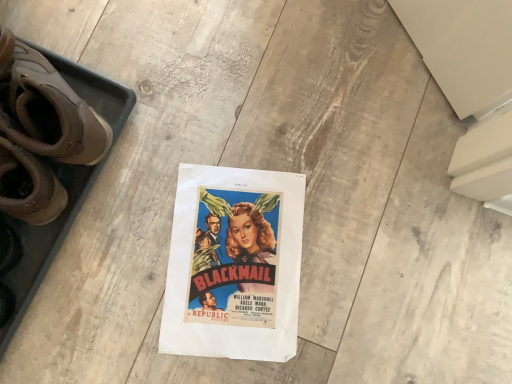
This screenshot has height=384, width=512. Describe the element at coordinates (234, 264) in the screenshot. I see `matte paper poster at center` at that location.

Where is `matte paper poster at center`? The image size is (512, 384). matte paper poster at center is located at coordinates (234, 264).

This screenshot has width=512, height=384. Describe the element at coordinates (54, 110) in the screenshot. I see `brown leather boots at left` at that location.

Find the location of a particular element. Image resolution: width=512 pixels, height=384 pixels. brown leather boots at left is located at coordinates (54, 110).

Find the location of a particular element. This screenshot has width=512, height=384. matte paper poster at center is located at coordinates (234, 264).

In the scene shown: Considering the relative positions of matte paper poster at center and brown leather boots at left in the image provided, is matte paper poster at center to the right of brown leather boots at left from the viewer's perspective?

Yes.

From the picture: Considering the positions of objects matte paper poster at center and brown leather boots at left in the image provided, who is in front, matte paper poster at center or brown leather boots at left?

Positioned in front is brown leather boots at left.

Does point (257, 257) lie behind point (0, 128)?

That is True.

From the picture: From the image's perspective, which object appears higher, matte paper poster at center or brown leather boots at left?

brown leather boots at left appears higher in the image.

From a real-world perspective, is matte paper poster at center above or below brown leather boots at left?

matte paper poster at center is situated lower than brown leather boots at left in the real world.

Considering the sizes of matte paper poster at center and brown leather boots at left in the image, is matte paper poster at center wider or thinner than brown leather boots at left?

Considering their sizes, matte paper poster at center looks broader than brown leather boots at left.

Considering the relative sizes of matte paper poster at center and brown leather boots at left in the image provided, is matte paper poster at center taller than brown leather boots at left?

No, matte paper poster at center is not taller than brown leather boots at left.

Looking at the image, does matte paper poster at center seem bigger or smaller compared to brown leather boots at left?

Clearly, matte paper poster at center is smaller in size than brown leather boots at left.

Is brown leather boots at left located within matte paper poster at center?

That's incorrect, brown leather boots at left is not inside matte paper poster at center.

In the scene shown: Is matte paper poster at center placed right next to brown leather boots at left?

No.

In the scene shown: Is matte paper poster at center facing towards brown leather boots at left?

No, matte paper poster at center is not aimed at brown leather boots at left.

Measure the distance between matte paper poster at center and brown leather boots at left.

The distance of matte paper poster at center from brown leather boots at left is 9.90 inches.

Locate an element on the screen. poster behind the brown leather boots at left is located at coordinates (234, 264).

Is brown leather boots at left to the left of matte paper poster at center from the viewer's perspective?

Yes, brown leather boots at left is to the left of matte paper poster at center.

Considering the positions of objects brown leather boots at left and matte paper poster at center in the image provided, who is behind, brown leather boots at left or matte paper poster at center?

matte paper poster at center is behind.

Does point (68, 141) come farther from viewer compared to point (226, 173)?

No, it is in front of (226, 173).

From the image's perspective, would you say brown leather boots at left is shown under matte paper poster at center?

No, from the image's perspective, brown leather boots at left is not beneath matte paper poster at center.

From a real-world perspective, which is physically above, brown leather boots at left or matte paper poster at center?

brown leather boots at left, from a real-world perspective.

Considering the sizes of objects brown leather boots at left and matte paper poster at center in the image provided, who is thinner, brown leather boots at left or matte paper poster at center?

brown leather boots at left.

Who is taller, brown leather boots at left or matte paper poster at center?

brown leather boots at left.

Is brown leather boots at left bigger than matte paper poster at center?

Yes.

Is brown leather boots at left inside or outside of matte paper poster at center?

brown leather boots at left is located beyond the bounds of matte paper poster at center.

Is brown leather boots at left next to matte paper poster at center and touching it?

There is a gap between brown leather boots at left and matte paper poster at center.

Is brown leather boots at left oriented towards matte paper poster at center?

No, brown leather boots at left is not oriented towards matte paper poster at center.

What's the angular difference between brown leather boots at left and matte paper poster at center's facing directions?

brown leather boots at left and matte paper poster at center are facing 125 degrees away from each other.

Measure the distance from brown leather boots at left to matte paper poster at center.

9.90 inches.

You are a GUI agent. You are given a task and a screenshot of the screen. Output one action in this format:
    pyautogui.click(x=<x>, y=<y>)
    Task: Click on the footwear above the matte paper poster at center (from a real-world perspective)
    The image size is (512, 384).
    Given the screenshot: What is the action you would take?
    pyautogui.click(x=54, y=110)

Find the location of a particular element. This screenshot has height=384, width=512. poster on the right of brown leather boots at left is located at coordinates (234, 264).

Find the location of a particular element. The height and width of the screenshot is (384, 512). poster below the brown leather boots at left (from the image's perspective) is located at coordinates (234, 264).